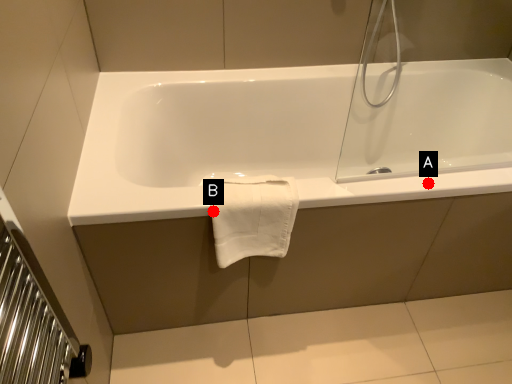
Question: Two points are circled on the image, labeled by A and B beside each circle. Among these points, which one is farthest from the camera?

Choices:
 (A) A is further
 (B) B is further

Answer: (A)